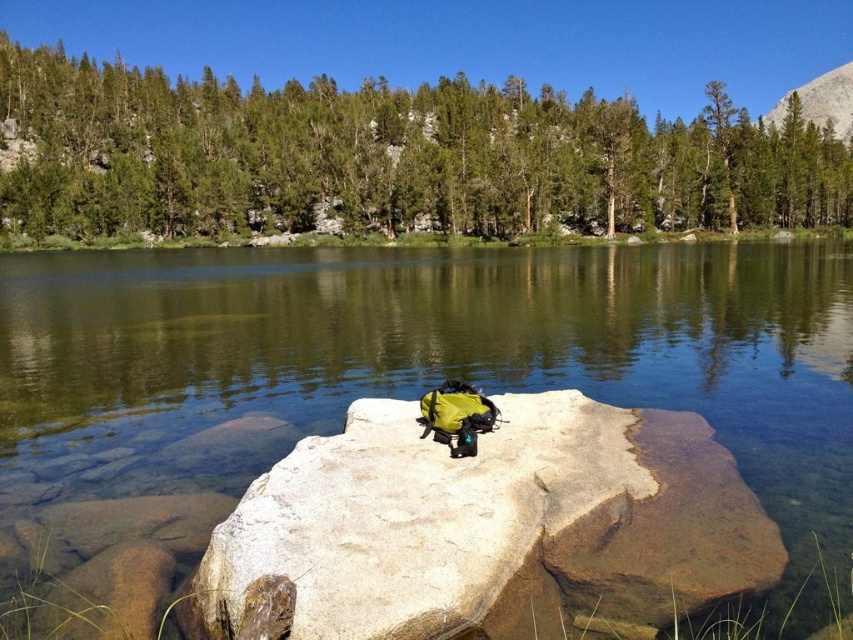
Question: Is green matte rock at center thinner than smooth granite boulder at center?

Choices:
 (A) yes
 (B) no

Answer: (B)

Question: Which point is farther to the camera?

Choices:
 (A) (798, 380)
 (B) (457, 460)

Answer: (A)

Question: Does green matte rock at center have a greater width compared to smooth granite boulder at center?

Choices:
 (A) yes
 (B) no

Answer: (A)

Question: Which point is closer to the camera?

Choices:
 (A) smooth granite boulder at center
 (B) green matte rock at center

Answer: (A)

Question: Which point is closer to the camera?

Choices:
 (A) (109, 304)
 (B) (610, 538)

Answer: (B)

Question: Does green matte rock at center appear over smooth granite boulder at center?

Choices:
 (A) no
 (B) yes

Answer: (B)